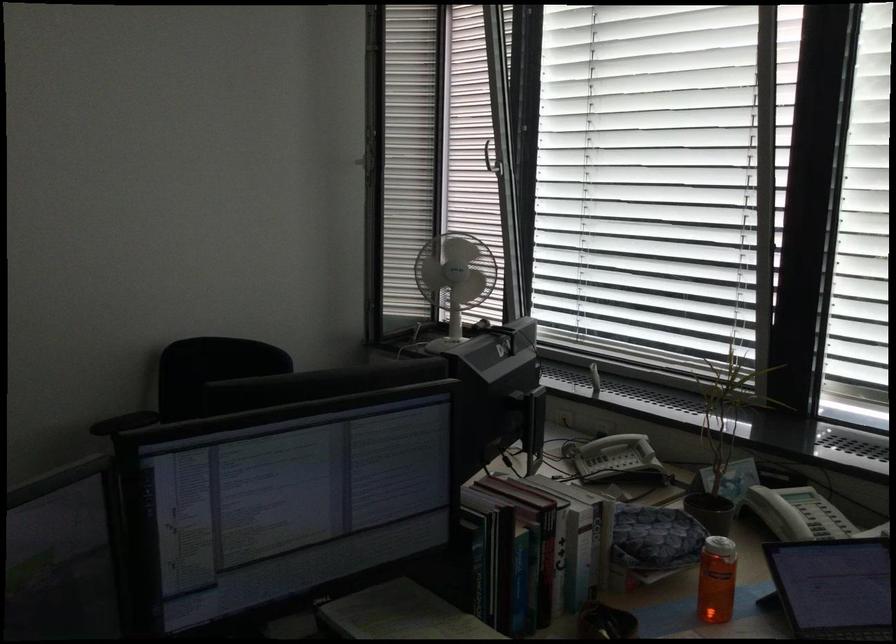
What do you see at coordinates (492, 158) in the screenshot?
I see `the silver window handle` at bounding box center [492, 158].